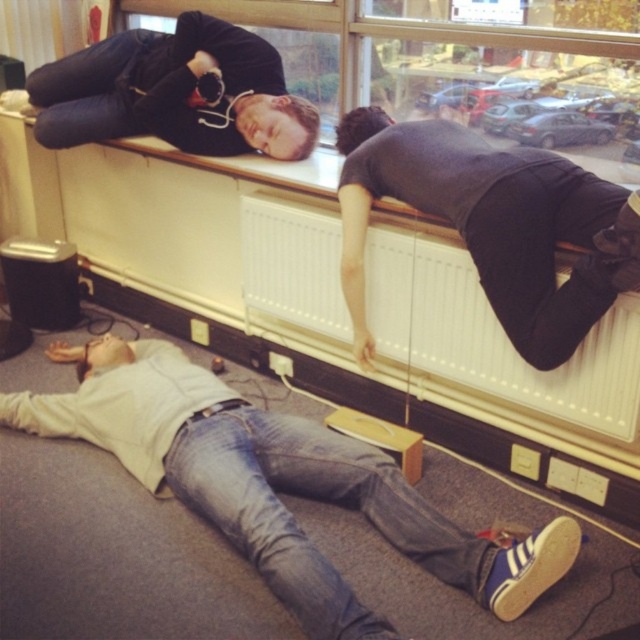
Does white textured radiator at upper center come in front of dark gray shirt at upper center?

No, it is not.

This screenshot has height=640, width=640. Describe the element at coordinates (492, 337) in the screenshot. I see `white textured radiator at upper center` at that location.

This screenshot has width=640, height=640. What do you see at coordinates (492, 337) in the screenshot?
I see `white textured radiator at upper center` at bounding box center [492, 337].

Locate an element on the screen. The image size is (640, 640). white textured radiator at upper center is located at coordinates (492, 337).

Between white matte shirt at lower left and dark gray shirt at upper center, which one is positioned higher?

dark gray shirt at upper center is higher up.

What are the coordinates of `white matte shirt at lower left` in the screenshot? It's located at (275, 483).

Locate an element on the screen. white matte shirt at lower left is located at coordinates (275, 483).

Find the location of a particular element. This screenshot has height=640, width=640. white matte shirt at lower left is located at coordinates (275, 483).

What do you see at coordinates (275, 483) in the screenshot? I see `white matte shirt at lower left` at bounding box center [275, 483].

Is point (141, 348) positioned after point (260, 252)?

No, (141, 348) is in front of (260, 252).

Locate an element on the screen. white matte shirt at lower left is located at coordinates (275, 483).